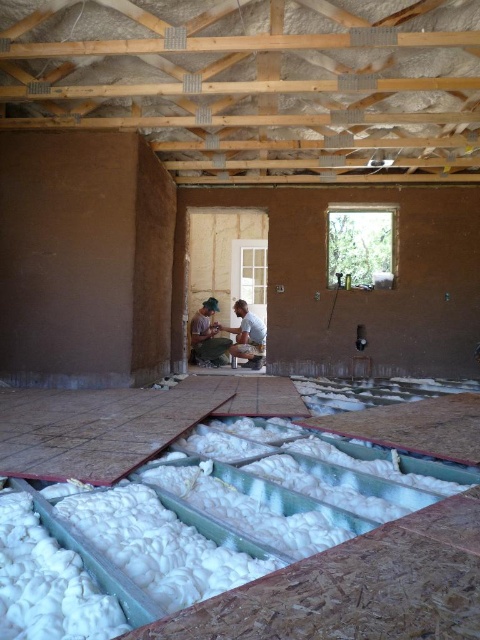
Question: Is white fluffy cotton at lower center above matte brown shirt at center?

Choices:
 (A) no
 (B) yes

Answer: (A)

Question: Can you confirm if matte brown shirt at center is wider than matte brown man at center?

Choices:
 (A) no
 (B) yes

Answer: (A)

Question: Which object appears farthest from the camera in this image?

Choices:
 (A) white fluffy cotton at lower center
 (B) matte brown shirt at center

Answer: (B)

Question: Does white fluffy cotton at lower center appear on the right side of matte brown shirt at center?

Choices:
 (A) no
 (B) yes

Answer: (B)

Question: Which object is the farthest from the matte brown shirt at center?

Choices:
 (A) white fluffy cotton at lower center
 (B) matte brown man at center

Answer: (A)

Question: Among these points, which one is nearest to the camera?

Choices:
 (A) (249, 358)
 (B) (225, 360)
 (C) (71, 541)

Answer: (C)